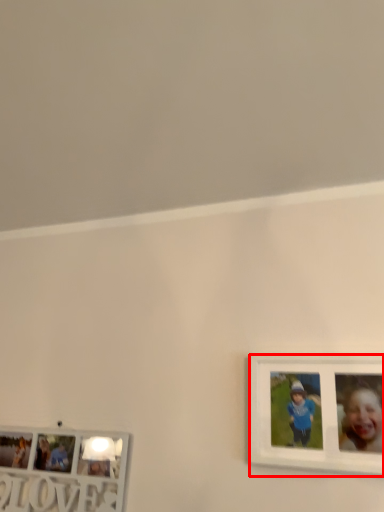
Question: From the image's perspective, where is picture frame (annotated by the red box) located in relation to picture frame in the image?

Choices:
 (A) below
 (B) above

Answer: (B)